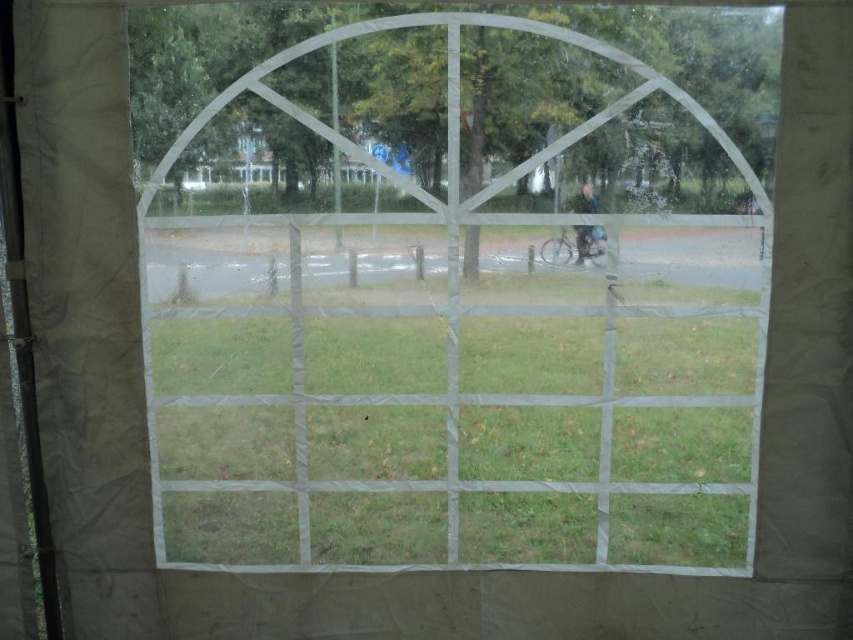
You are standing inside a tent and looking through the transparent plastic window at center. You want to check if the green grass at center is visible through the window. Can you see it clearly?

The transparent plastic window at center is closer to the viewer than green grass at center, so yes, the green grass at center is visible through the window but may appear slightly blurred due to the window being closer and possibly fogged or dirty as described in the scene.

You need to determine if the transparent plastic window at center can fully cover the green grass at center when placed over it. Based on their sizes, what do you think?

The transparent plastic window at center is larger in size than green grass at center, so yes, it can fully cover the green grass at center.